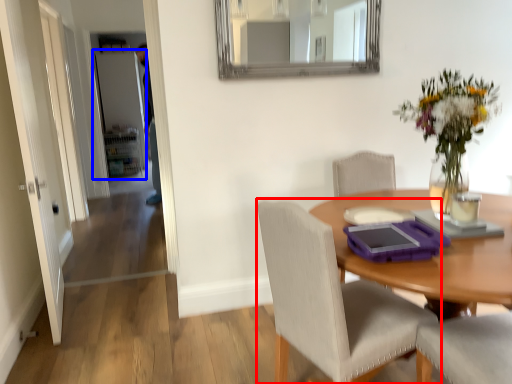
Question: Which object appears farthest to the camera in this image, chair (highlighted by a red box) or door (highlighted by a blue box)?

Choices:
 (A) chair
 (B) door

Answer: (B)